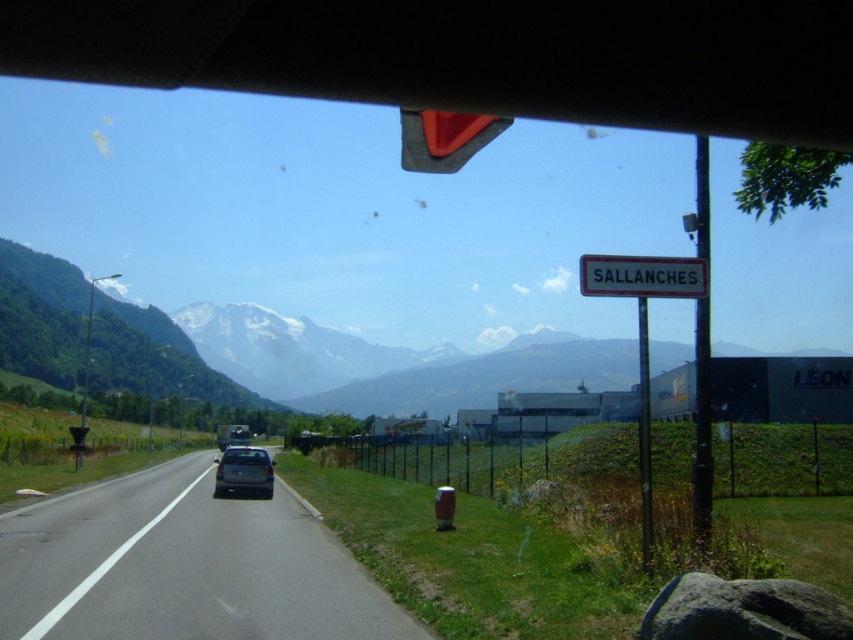
You are driving a car and want to know if the white plastic sign at upper center can fit entirely within the width of the slate gray metallic car at center. Based on the scene, can it?

The white plastic sign at upper center is narrower than the slate gray metallic car at center, so it can fit within the car.

You are driving a car and want to stay on the road. Based on the scene, where should you position your vehicle relative to the point at coordinates point (183, 566)?

You should position your vehicle on the smooth asphalt road at center located at point (183, 566) to stay on the road.